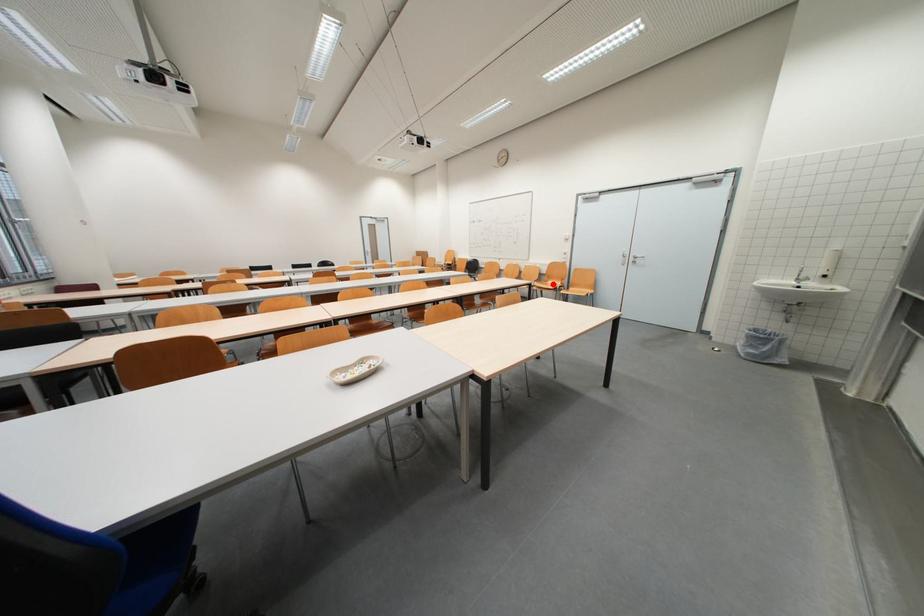
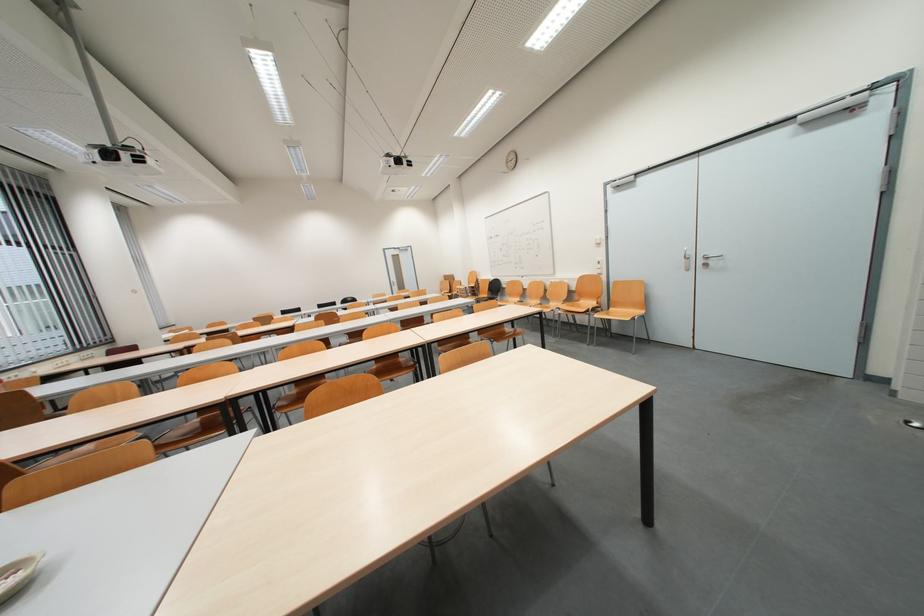
Question: A red point is marked in image1. In image2, is the corresponding 3D point closer to the camera or farther? Reply with the corresponding letter.

Choices:
 (A) The corresponding 3D point is closer.
 (B) The corresponding 3D point is farther.

Answer: (A)